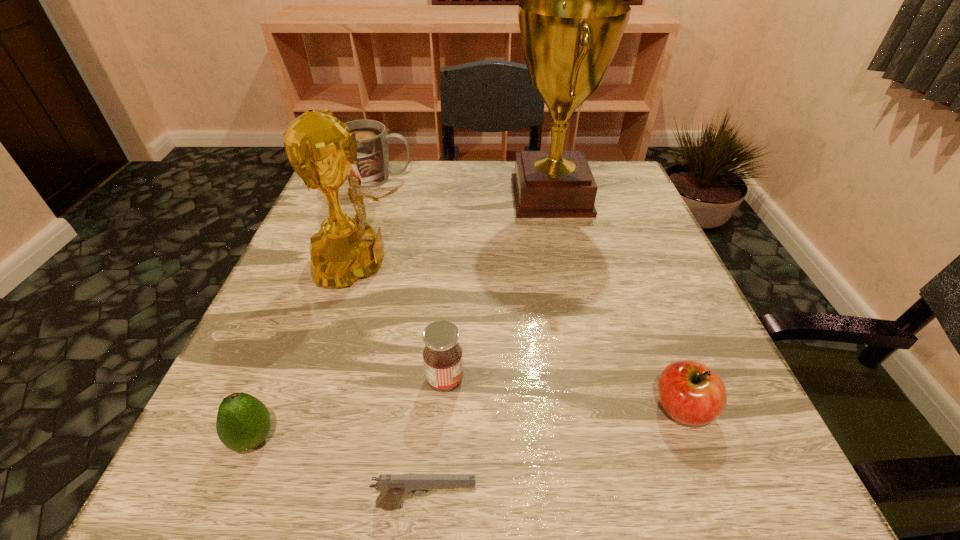
Locate an element on the screen. This screenshot has height=540, width=960. free spot that satisfies the following two spatial constraints: 1. on the side of the mug with the handle; 2. on the left side of the apple is located at coordinates (302, 408).

At what (x,y) coordinates should I click in order to perform the action: click on blank space that satisfies the following two spatial constraints: 1. on the back side of the apple; 2. on the front side of the nearer award. Please return your answer as a coordinate pair (x, y). This screenshot has height=540, width=960. Looking at the image, I should click on pos(628,264).